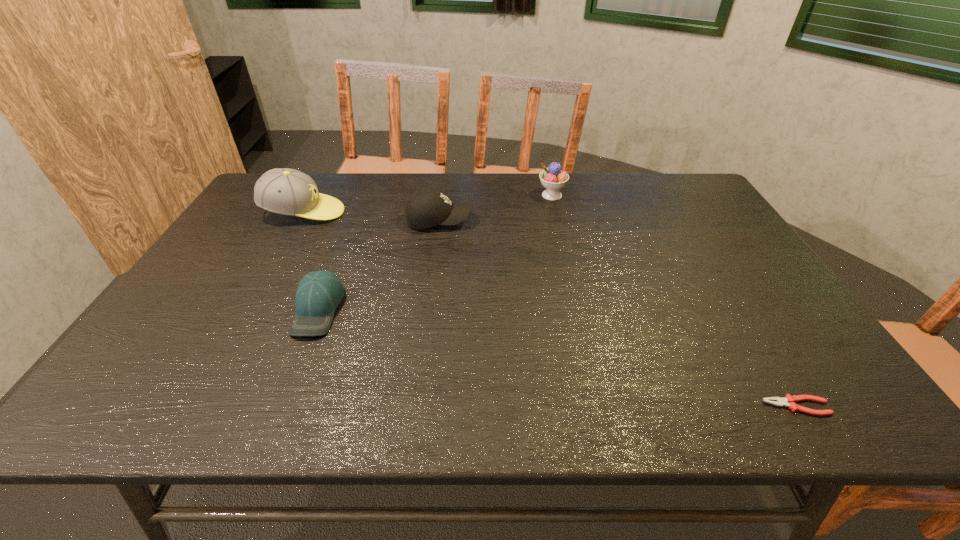
Where is `the tallest baseball cap`? The image size is (960, 540). the tallest baseball cap is located at coordinates (x=284, y=191).

Locate an element on the screen. The height and width of the screenshot is (540, 960). the fourth object from left to right is located at coordinates (552, 178).

Image resolution: width=960 pixels, height=540 pixels. Identify the location of the second shortest baseball cap. (427, 208).

Identify the location of the third object from right to left. The height and width of the screenshot is (540, 960). (427, 208).

Locate an element on the screen. the fourth farthest object is located at coordinates (318, 294).

Where is `the second shortest object`? the second shortest object is located at coordinates (318, 294).

Find the location of a particular element. This screenshot has width=960, height=540. the rightmost object is located at coordinates (789, 401).

You are a GUI agent. You are given a task and a screenshot of the screen. Output one action in this format:
    pyautogui.click(x=<x>, y=<y>)
    Task: Click on the shortest object
    The image size is (960, 540).
    Given the screenshot: What is the action you would take?
    pyautogui.click(x=789, y=401)

In order to click on free space located on the front-facing side of the tallest baseball cap in this screenshot , I will do `click(444, 212)`.

At what (x,y) coordinates should I click in order to perform the action: click on vacant space located 0.090m on the back of the second object from right to left. Please return your answer as a coordinate pair (x, y). This screenshot has width=960, height=540. Looking at the image, I should click on (547, 176).